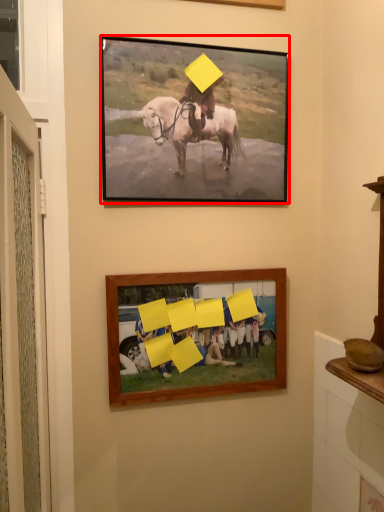
Question: From the image's perspective, where is picture frame (annotated by the red box) located relative to picture frame?

Choices:
 (A) below
 (B) above

Answer: (B)